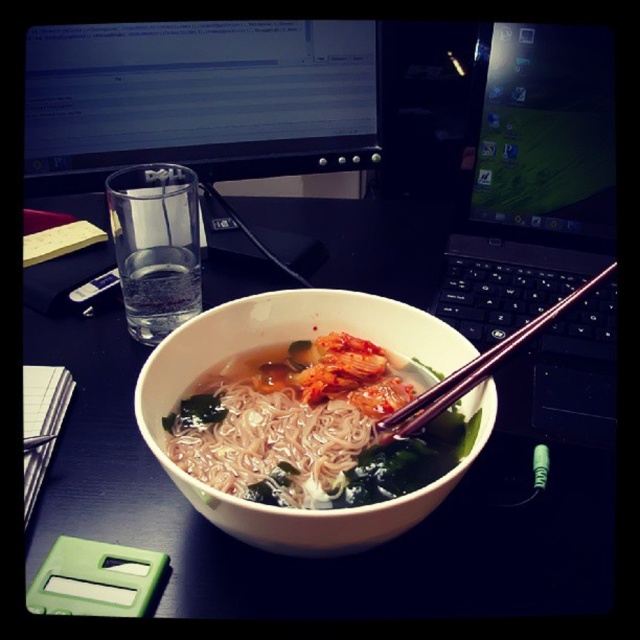
Between white glossy bowl at center and black plastic laptop at center, which one is positioned lower?

white glossy bowl at center

This screenshot has height=640, width=640. What do you see at coordinates (353, 554) in the screenshot? I see `white glossy bowl at center` at bounding box center [353, 554].

What do you see at coordinates (353, 554) in the screenshot? This screenshot has width=640, height=640. I see `white glossy bowl at center` at bounding box center [353, 554].

This screenshot has height=640, width=640. I want to click on white glossy bowl at center, so click(x=353, y=554).

Does white matte bowl at center have a lesser height compared to white matte noodles at center?

In fact, white matte bowl at center may be taller than white matte noodles at center.

At what (x,y) coordinates should I click in order to perform the action: click on white matte bowl at center. Please return your answer as a coordinate pair (x, y). The image size is (640, 640). Looking at the image, I should click on (285, 342).

Where is `white matte bowl at center`? The width and height of the screenshot is (640, 640). white matte bowl at center is located at coordinates (285, 342).

In the scene shown: Is white glossy bowl at center shorter than matte black monitor at upper center?

In fact, white glossy bowl at center may be taller than matte black monitor at upper center.

Who is shorter, white glossy bowl at center or matte black monitor at upper center?

Standing shorter between the two is matte black monitor at upper center.

Which is behind, point (326, 243) or point (48, 116)?

Positioned behind is point (326, 243).

The width and height of the screenshot is (640, 640). I want to click on white glossy bowl at center, so click(x=353, y=554).